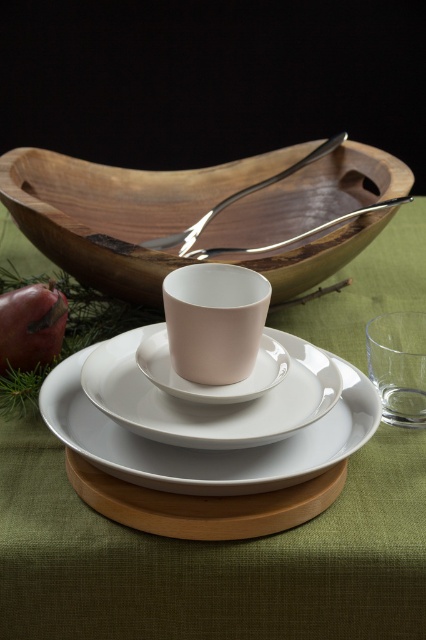
You are setting the table and see the white matte plate at center and the white glossy platter at center. Which one is positioned more to the right?

The white glossy platter at center is positioned more to the right than the white matte plate at center.

You are setting up a table for a dinner party and have both the white matte plate at center and the white glossy platter at center. Which one is placed on top of the other?

The white matte plate at center is positioned over the white glossy platter at center, so it is placed on top.

You are setting up a table and need to place the matte ceramic cup at center and the silver metallic spoon at upper center. Considering their sizes, which item will require more horizontal space on the table?

The silver metallic spoon at upper center requires more horizontal space because its width is greater than the matte ceramic cup at center.